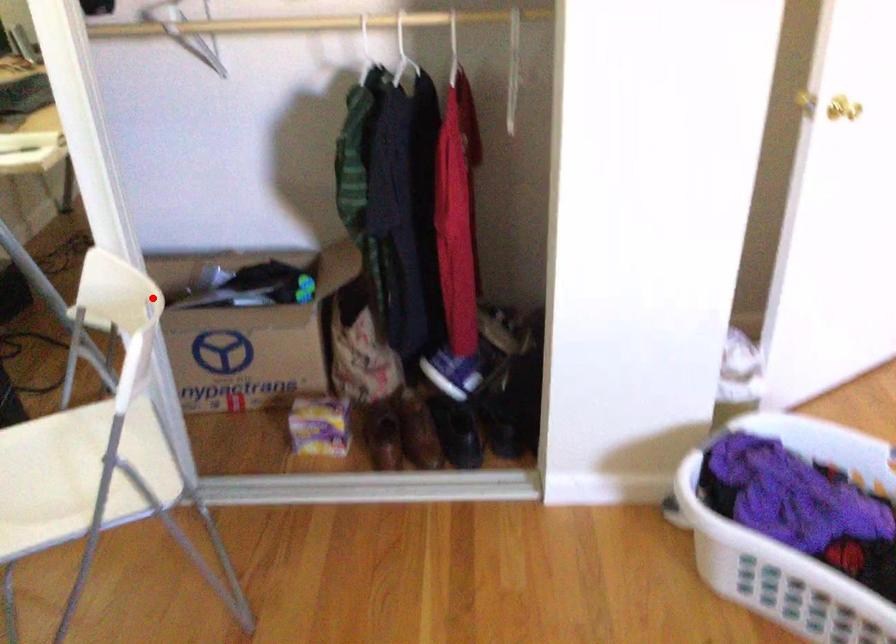
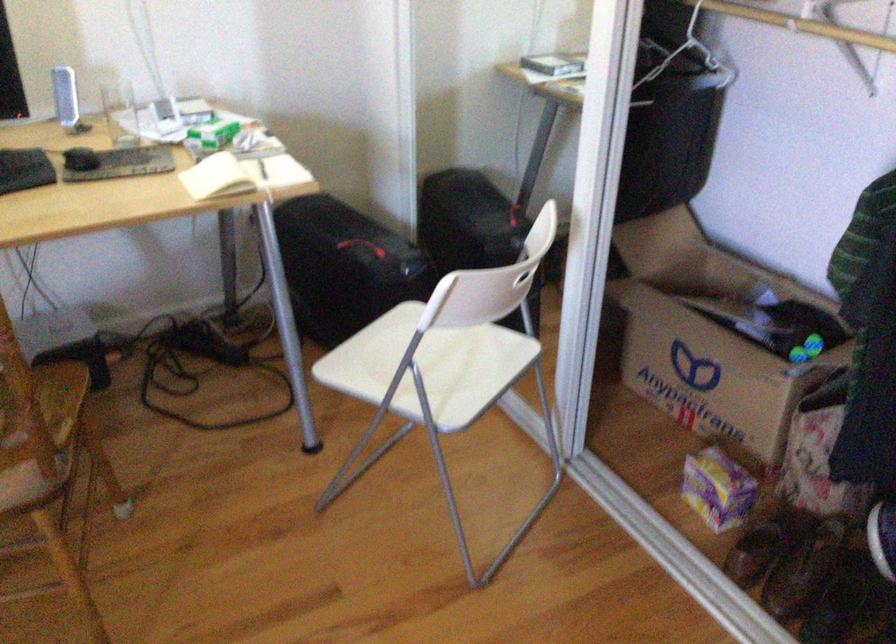
In the second image, find the point that corresponds to the highlighted location in the first image.

(528, 269)